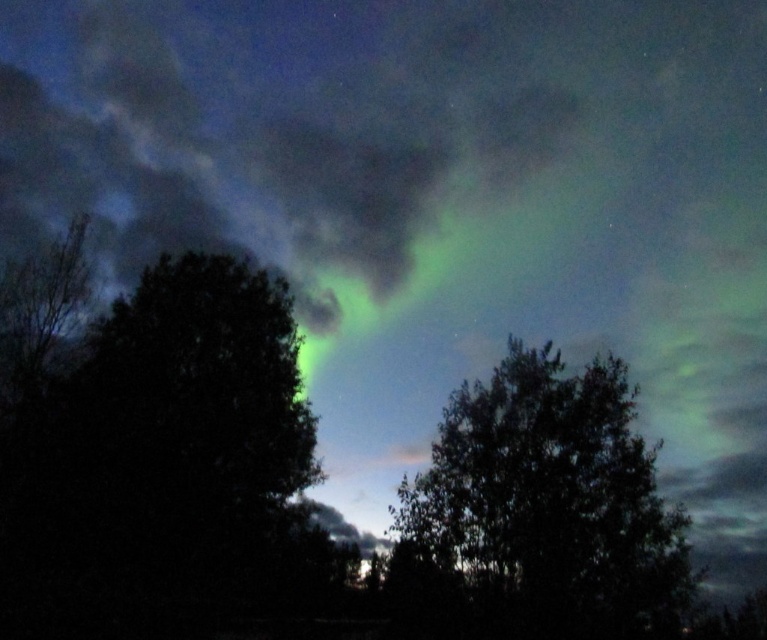
Question: Which object is the closest to the green translucent aurora at upper center?

Choices:
 (A) green leafy tree at center
 (B) green leafy tree at left

Answer: (B)

Question: Which point is closer to the camera?

Choices:
 (A) (304, 604)
 (B) (255, 134)

Answer: (A)

Question: Does green translucent aurora at upper center appear on the right side of green leafy tree at center?

Choices:
 (A) no
 (B) yes

Answer: (A)

Question: Is green translucent aurora at upper center wider than green leafy tree at left?

Choices:
 (A) no
 (B) yes

Answer: (B)

Question: Based on their relative distances, which object is nearer to the green leafy tree at center?

Choices:
 (A) green leafy tree at left
 (B) green translucent aurora at upper center

Answer: (A)

Question: Does green leafy tree at left lie behind green leafy tree at center?

Choices:
 (A) no
 (B) yes

Answer: (B)